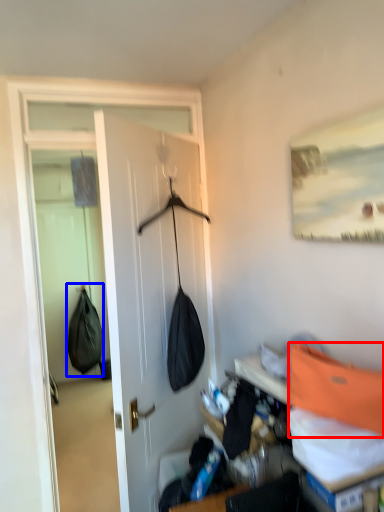
Question: Among these objects, which one is farthest to the camera, shoulder bag (highlighted by a red box) or shoulder bag (highlighted by a blue box)?

Choices:
 (A) shoulder bag
 (B) shoulder bag

Answer: (B)